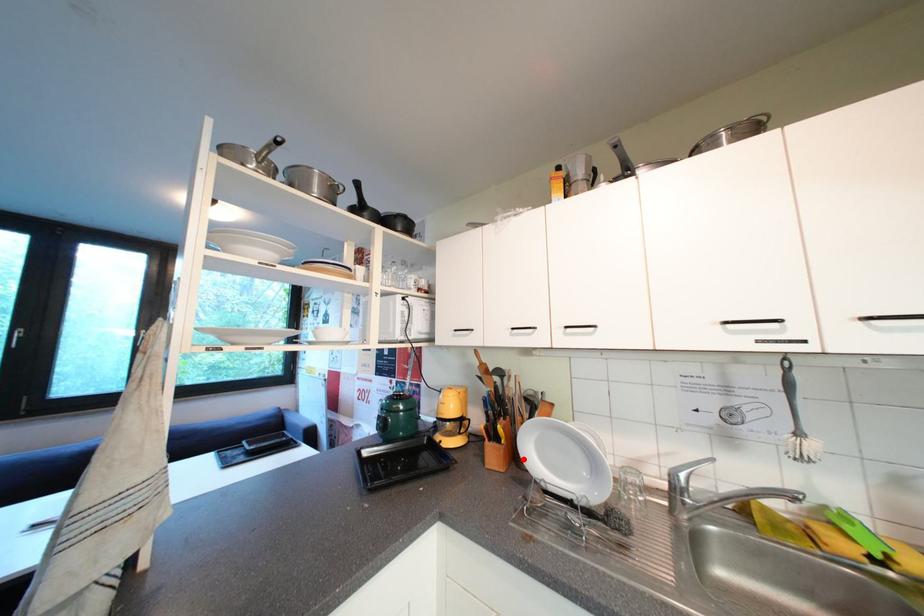
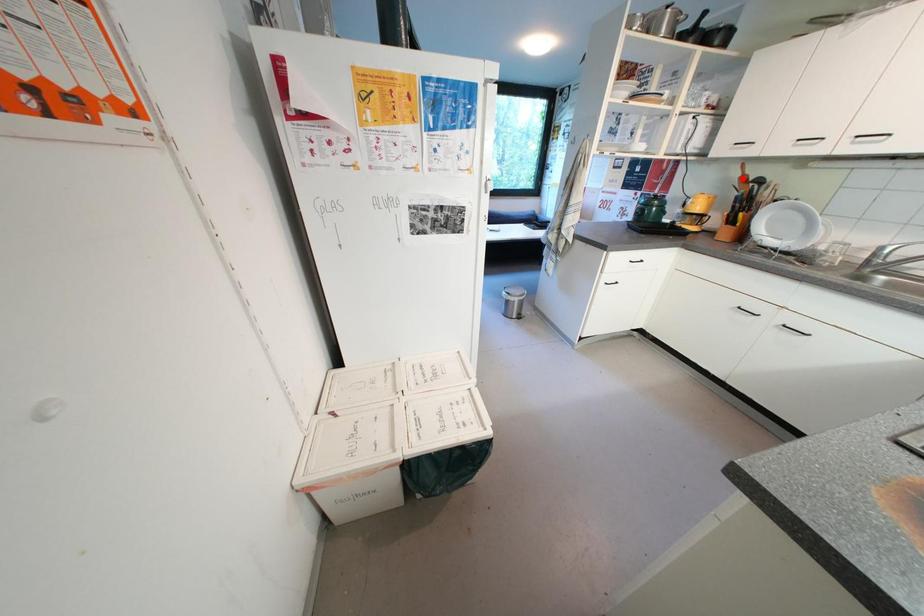
I am providing you with two images of the same scene from different viewpoints. A red point is marked on the first image and another point is marked on the second image. Do the highlighted points in image1 and image2 indicate the same real-world spot?

No